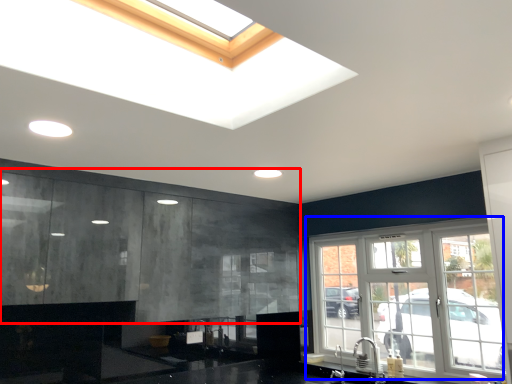
Question: Which object appears farthest to the camera in this image, cabinetry (highlighted by a red box) or window (highlighted by a blue box)?

Choices:
 (A) cabinetry
 (B) window

Answer: (B)